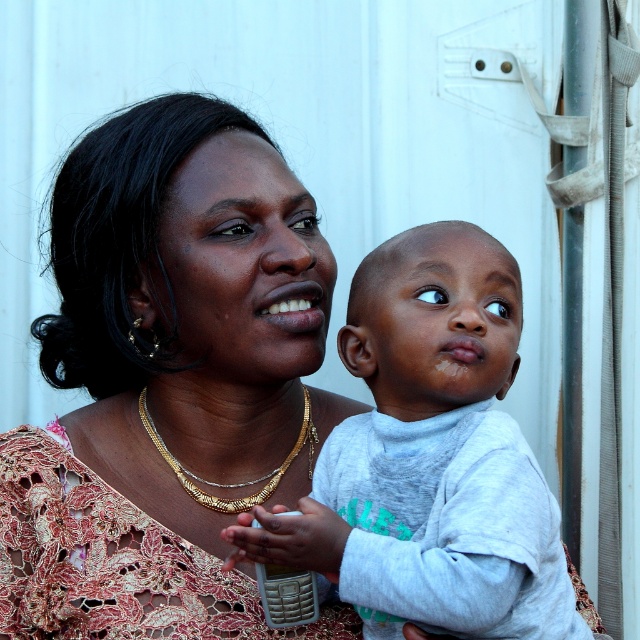
Is matte gold necklace at center positioned in front of gold chain necklace at center?

Yes.

In the scene shown: Can you confirm if matte gold necklace at center is thinner than gold chain necklace at center?

No, matte gold necklace at center is not thinner than gold chain necklace at center.

Who is more distant from viewer, (131, 225) or (228, 486)?

The point (228, 486) is more distant.

This screenshot has width=640, height=640. In order to click on matte gold necklace at center in this screenshot , I will do `click(168, 380)`.

Can you confirm if gray cotton shirt at center is positioned above gold chain necklace at center?

Correct, gray cotton shirt at center is located above gold chain necklace at center.

Which of these two, gray cotton shirt at center or gold chain necklace at center, stands shorter?

Standing shorter between the two is gold chain necklace at center.

Identify the location of gray cotton shirt at center. The height and width of the screenshot is (640, 640). (433, 321).

You are a GUI agent. You are given a task and a screenshot of the screen. Output one action in this format:
    pyautogui.click(x=<x>, y=<y>)
    Task: Click on the gray cotton shirt at center
    
    Given the screenshot: What is the action you would take?
    pyautogui.click(x=433, y=321)

Is matte gold necklace at center smaller than gray cotton shirt at center?

Incorrect, matte gold necklace at center is not smaller in size than gray cotton shirt at center.

Does point (38, 637) lie behind point (451, 336)?

That is True.

Between point (230, 108) and point (481, 358), which one is positioned in front?

Positioned in front is point (481, 358).

The height and width of the screenshot is (640, 640). In order to click on matte gold necklace at center in this screenshot , I will do `click(168, 380)`.